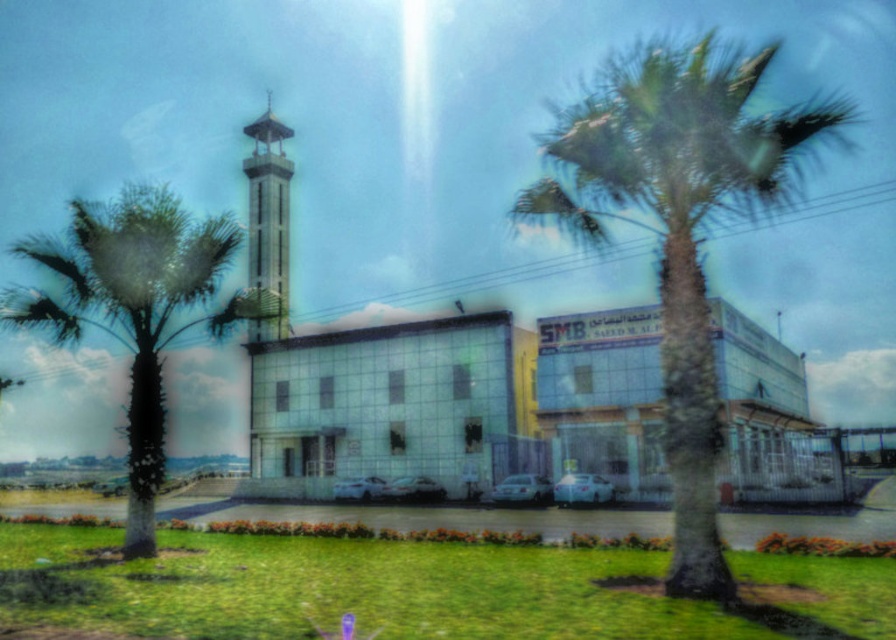
You are a visitor standing in front of the modern building complex. You see the green leafy palm tree at left and the white glass bell tower at center. Which object is closer to the front of the image?

The green leafy palm tree at left is closer to the front of the image because it is positioned under the white glass bell tower at center, indicating it is in front of the tower.

You are a visitor arriving at the building and need to park your car, which is 4 meters long. The parking lot has two available spots near the entrance. The first spot is next to the silver metallic car at center, and the second is next to the matte white car at center. Which parking spot would allow your car to fit better?

The matte white car at center is larger than the silver metallic car at center. Since your car is 4 meters long, the parking spot next to the matte white car at center likely has more space and would allow your car to fit better.